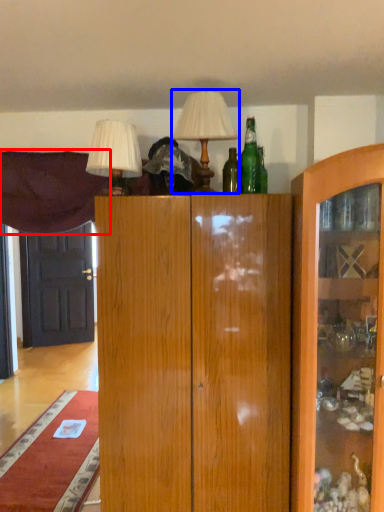
Question: Which point is further to the camera, curtain (highlighted by a red box) or table lamp (highlighted by a blue box)?

Choices:
 (A) curtain
 (B) table lamp

Answer: (A)